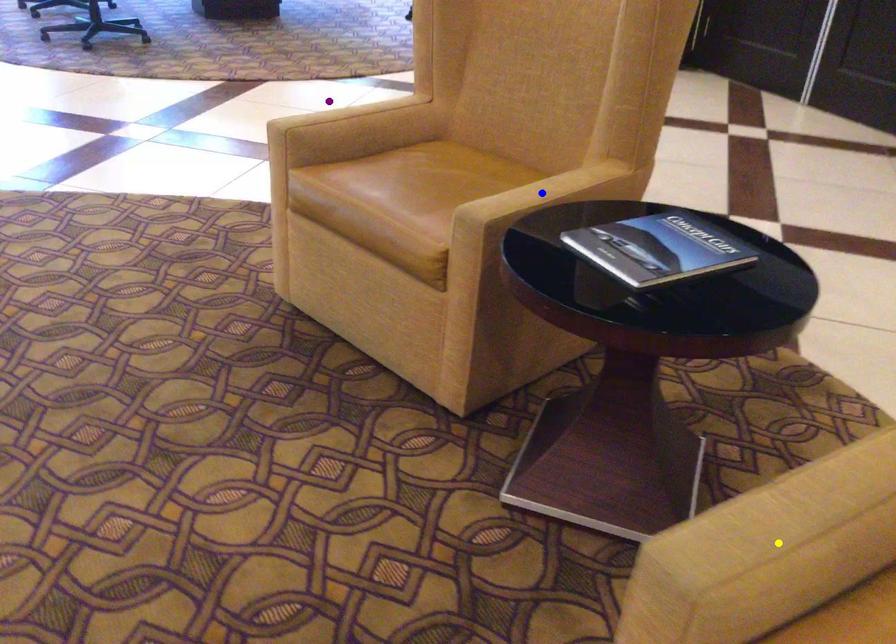
From the picture: Order these from nearest to farthest:
1. blue point
2. yellow point
3. purple point

purple point
blue point
yellow point